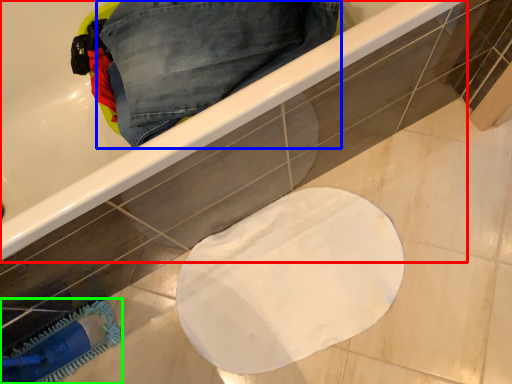
Question: Which object is the farthest from bathtub (highlighted by a red box)? Choose among these: trousers (highlighted by a blue box) or brush (highlighted by a green box).

Choices:
 (A) trousers
 (B) brush

Answer: (B)